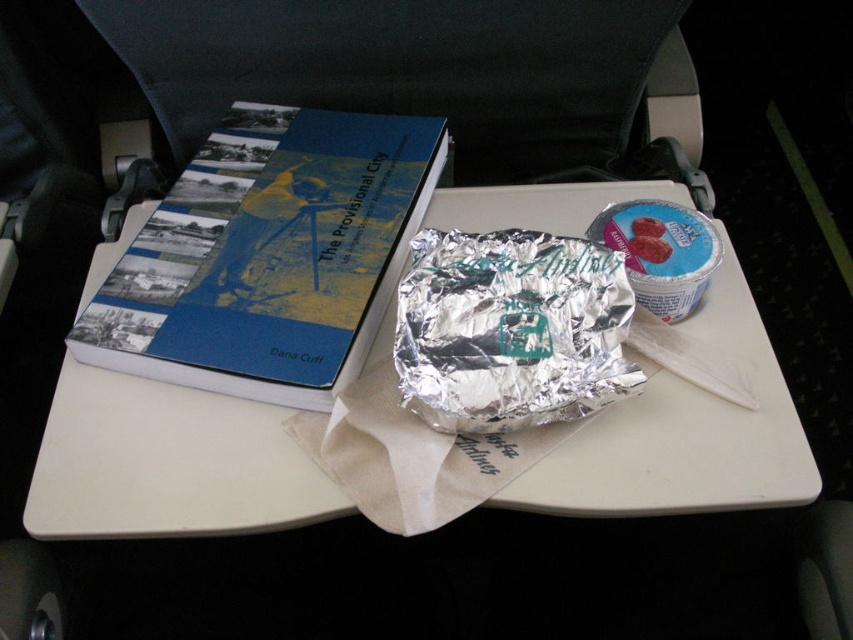
You are a flight attendant checking the tray table and book on the airplane. You need to ensure the blue matte hardcover book at upper left doesn t fall off the white plastic tray at center. Is the tray high enough to prevent this?

The white plastic tray at center has a greater height compared to the blue matte hardcover book at upper left, so the tray is tall enough to prevent the book from falling off.

Looking at this image, you are sitting in an airplane seat and want to reach for an item on the tray table. You notice two points marked on the table. Which point is closer to you, point (x=775, y=474) or point (x=503, y=236)?

Point (x=775, y=474) is in front of point (x=503, y=236), so it is closer to you.

You are a passenger on an airplane who wants to reach the silver foil wrap at center to eat your meal. However, the blue matte hardcover book at upper left is blocking your access. Can you slide the book to the side to get to the wrap?

The silver foil wrap at center is behind the blue matte hardcover book at upper left, so you can slide the blue matte hardcover book at upper left to the side to access the silver foil wrap at center.